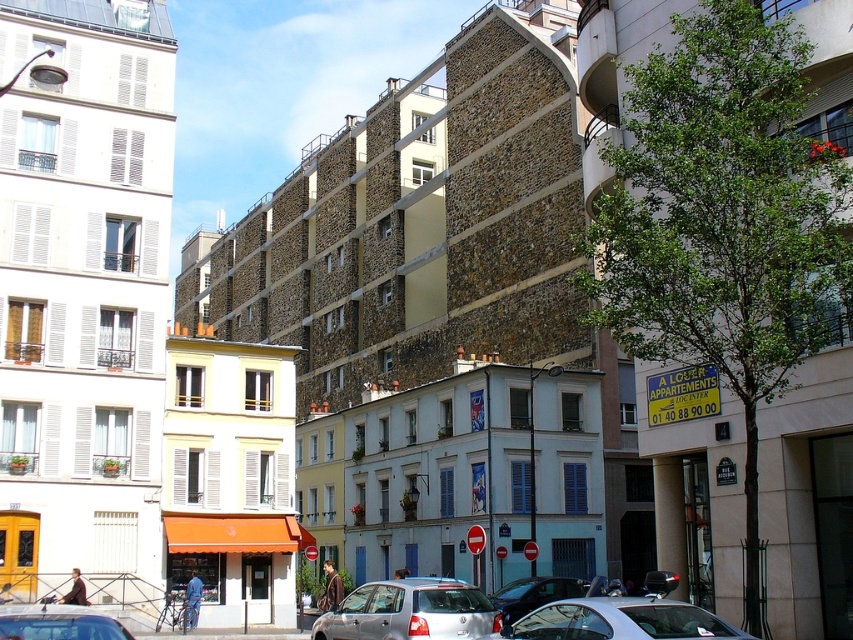
You are a delivery person needing to park your silver metallic car at center in this street scene. There is another metallic silver car at center already parked. Can you park your car without overlapping with the existing one?

The silver metallic car at center is already positioned over the metallic silver car at center, indicating that there is no space available. You cannot park your car without overlapping.

You are a delivery driver who needs to park your silver metallic car at center and silver metallic car at lower left in this urban street scene. Based on their current positions, which car is closer to the yellowish building with the orange awning?

The silver metallic car at lower left is closer to the yellowish building with the orange awning because it is positioned to the left of the silver metallic car at center, which is further to the right.